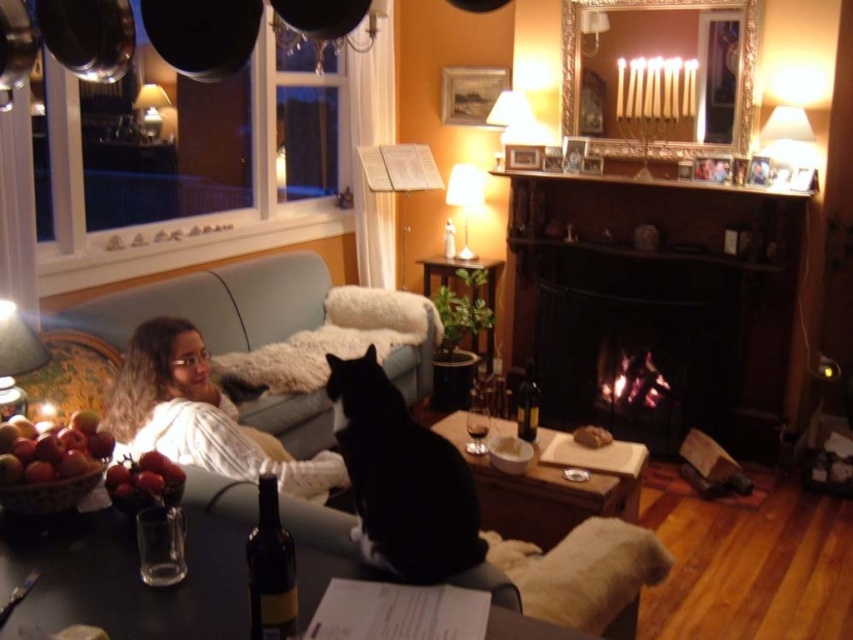
You are a photographer setting up a shot in this living room. You want to place a small lamp between the two points marked as point (618, 541) and point (270, 588). Which point should the lamp be closer to in order to be in focus if your camera is focused on the closer point?

The lamp should be closer to point (618, 541) because it is further to the camera than point (270, 588), so focusing on the closer point would require placing the lamp nearer to the farther point to maintain focus.

In the scene shown: You are a chef preparing ingredients for a recipe. You need to place a wooden cutting board at center on a flat surface. However, there is a black fur cat at center currently occupying that spot. Can you move the cat to make space for the cutting board?

The black fur cat at center is positioned over the wooden cutting board at center, so you would need to gently move the cat to access the cutting board.

You are a guest in this living room and want to place a small book on the table between the fuzzy white blanket at lower center and the dark glass bottle at center. Is there enough space for the book?

The fuzzy white blanket at lower center is positioned on the left side of dark glass bottle at center, so there is space between them to place the small book.